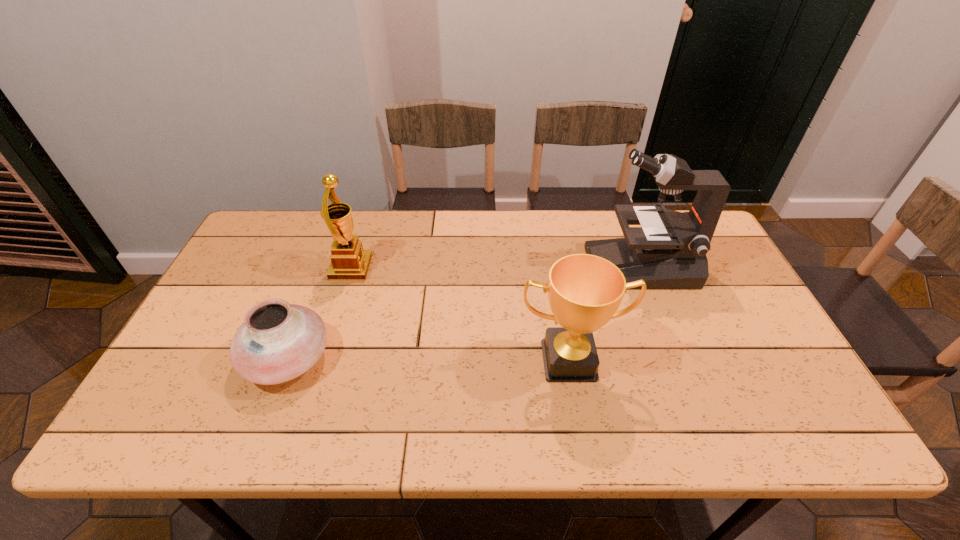
Locate an element on the screen. The image size is (960, 540). microscope is located at coordinates (668, 251).

Where is `the farther award`? The width and height of the screenshot is (960, 540). the farther award is located at coordinates (349, 261).

This screenshot has width=960, height=540. I want to click on the right award, so point(585,291).

Find the location of a particular element. The image size is (960, 540). pottery is located at coordinates 277,342.

Find the location of a particular element. The width and height of the screenshot is (960, 540). vacant area located 0.170m through the eyepieces of the tallest object is located at coordinates (533, 266).

At what (x,y) coordinates should I click in order to perform the action: click on free space located through the eyepieces of the tallest object. Please return your answer as a coordinate pair (x, y). Looking at the image, I should click on (530, 266).

Find the location of a particular element. vacant space located through the eyepieces of the tallest object is located at coordinates coord(533,266).

At what (x,y) coordinates should I click in order to perform the action: click on vacant area situated 0.190m on the front-facing side of the farther award. Please return your answer as a coordinate pair (x, y). This screenshot has width=960, height=540. Looking at the image, I should click on (432, 268).

Identify the location of vacant area situated on the front-facing side of the nearer award. (577, 407).

Locate an element on the screen. vacant space situated on the front of the pottery is located at coordinates (262, 426).